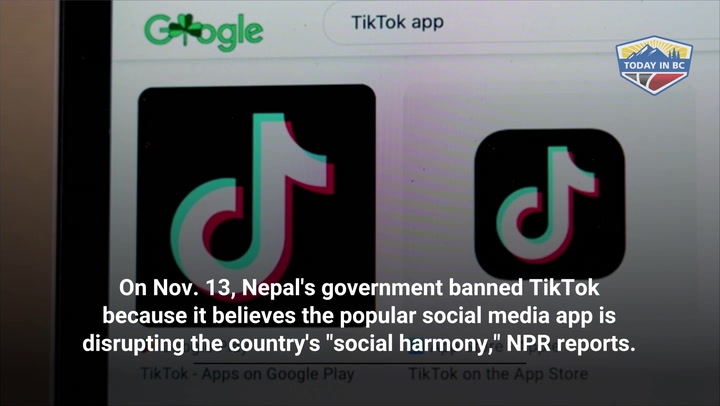
This screenshot has height=406, width=720. Find the location of `device screen (black)`. device screen (black) is located at coordinates [78, 246].